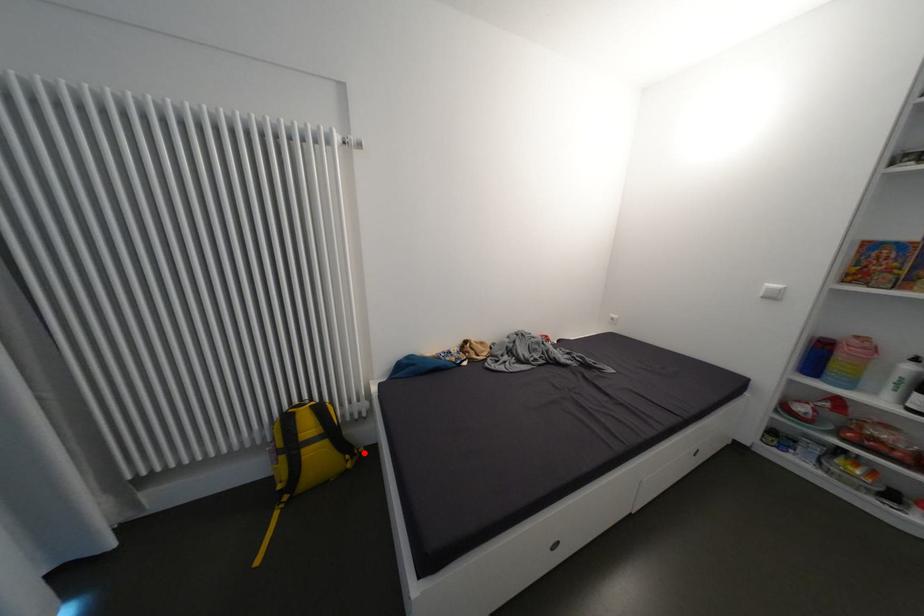
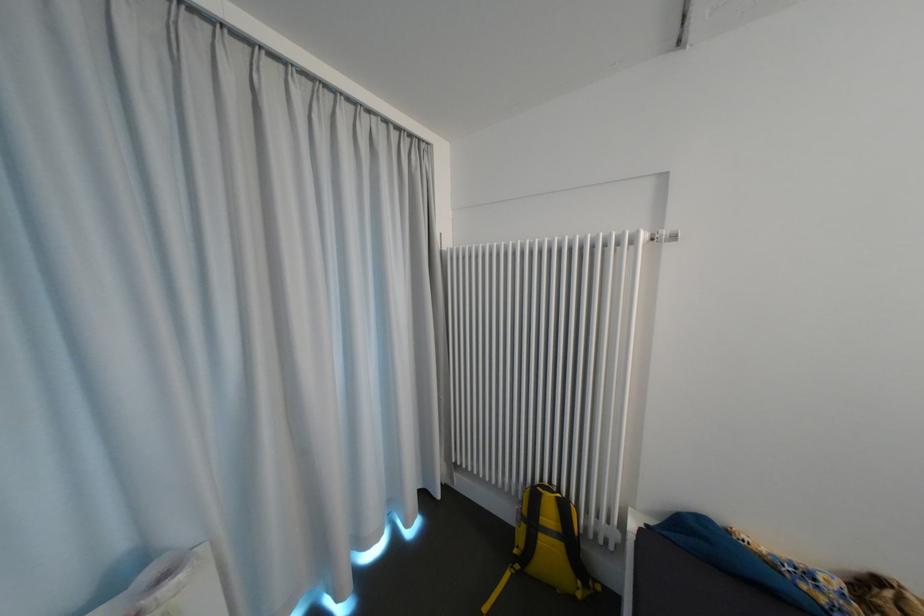
Question: I am providing you with two images of the same scene from different viewpoints. Image1 has a red point marked. In image2, the corresponding 3D location appears at what relative position? Reply with the corresponding letter.

Choices:
 (A) Closer
 (B) Farther

Answer: (A)